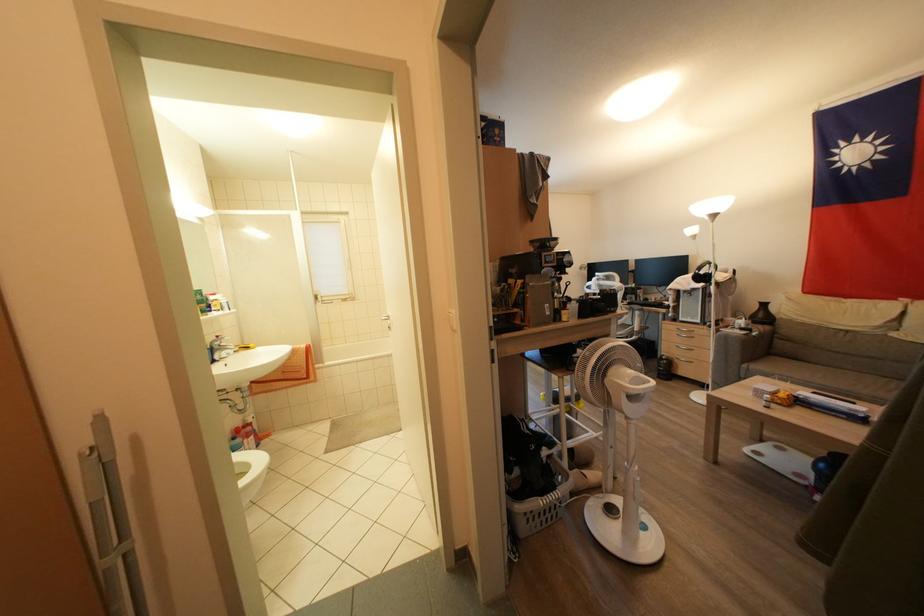
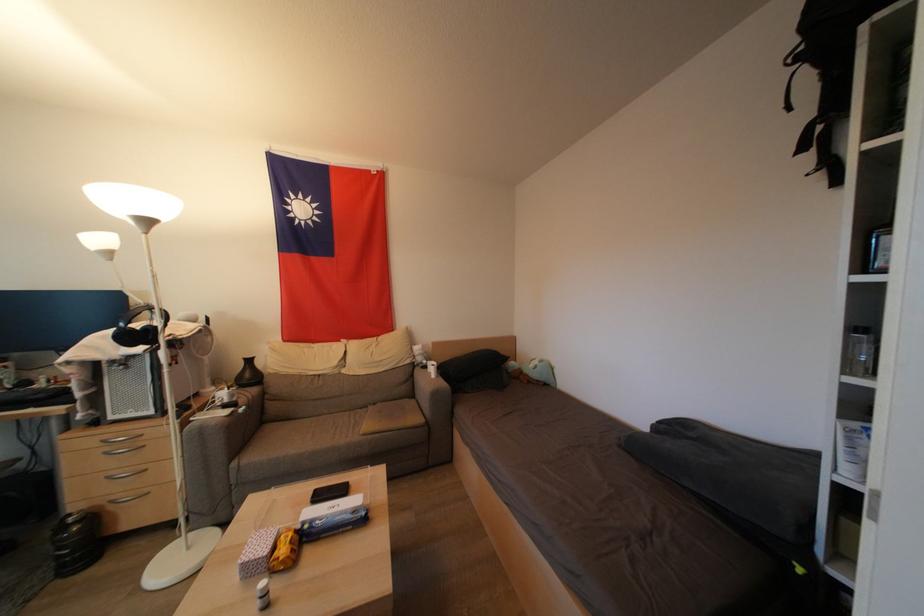
Find the pixel in the second image that matches (696,235) in the first image.

(104, 244)